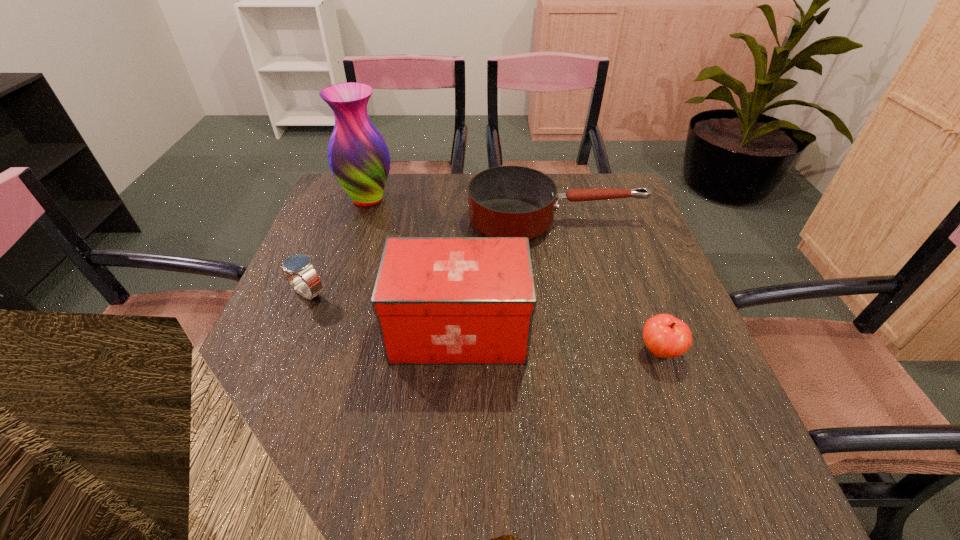
Identify the location of vase. This screenshot has width=960, height=540. (359, 158).

Where is `the fourth shortest object`? The width and height of the screenshot is (960, 540). the fourth shortest object is located at coordinates (438, 300).

Locate an element on the screen. This screenshot has width=960, height=540. pan is located at coordinates (507, 201).

Where is `apple`? apple is located at coordinates (666, 336).

Locate an element on the screen. watch is located at coordinates (299, 265).

The height and width of the screenshot is (540, 960). What are the coordinates of `vacant space located 0.160m on the right of the tallest object` in the screenshot? It's located at (449, 199).

Identify the location of free space located on the handle side of the second tallest object. The image size is (960, 540). (551, 331).

At what (x,y) coordinates should I click in order to perform the action: click on vacant space situated on the front of the apple. Please return your answer as a coordinate pair (x, y). The height and width of the screenshot is (540, 960). Looking at the image, I should click on (716, 503).

Identify the location of free location located 0.070m on the front of the watch. This screenshot has width=960, height=540. tap(293, 330).

Find the location of a particular element. This screenshot has width=960, height=540. vase positioned at the far edge is located at coordinates (359, 158).